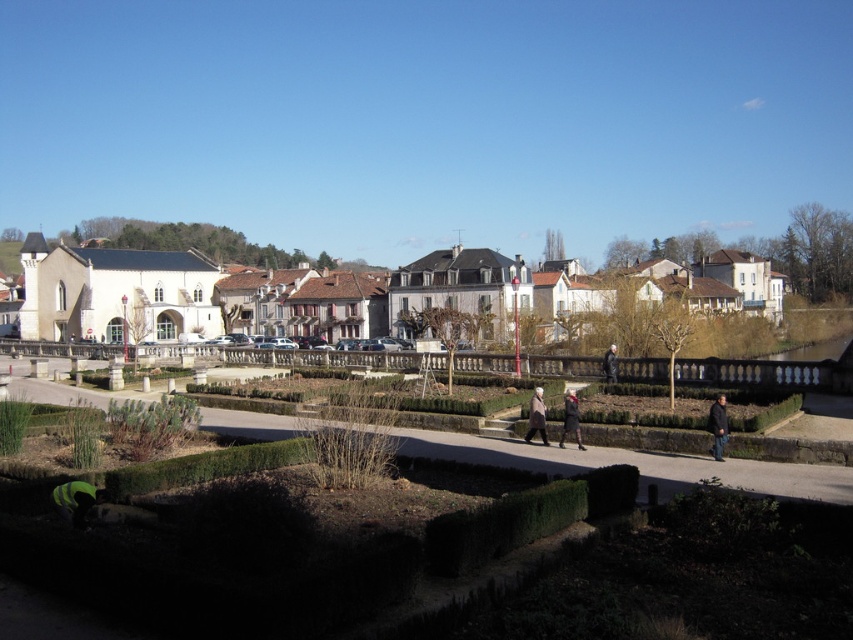
You are a fashion enthusiast who wants to choose between the black leather jacket at lower right and the dark brown leather coat at center for a cold winter day. Which one would provide better insulation based on their thickness?

The dark brown leather coat at center is thicker than the black leather jacket at lower right, so it would provide better insulation for a cold winter day.

You are a tourist in the town and want to take a photo of the white stone buildings at center without the dark gray coat at center blocking the view. Based on their sizes, which object should you focus on to ensure the other doesn

The white stone buildings at center are larger than the dark gray coat at center. To avoid the dark gray coat at center blocking the view, focus on the white stone buildings at center as it is bigger and likely occupies more space in the frame.

You are planning to take a photo of the white stone buildings at center and the green grass at center in the European town scene. Since you want both to be clearly visible in the frame, which object should you prioritize keeping closer to the camera to ensure it doesn t get cut off?

The white stone buildings at center should be prioritized closer to the camera since their width surpasses that of the green grass at center, making them more likely to extend beyond the frame if positioned farther away.